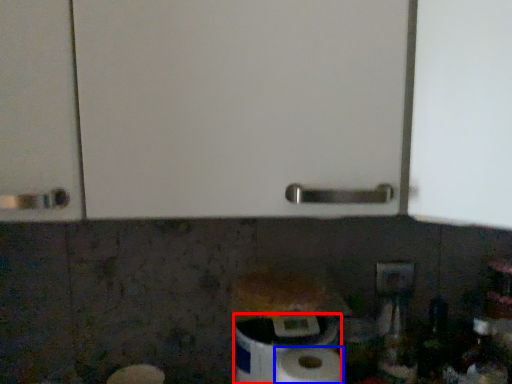
Question: Which object is further to the camera taking this photo, toilet paper (highlighted by a red box) or paper towel (highlighted by a blue box)?

Choices:
 (A) toilet paper
 (B) paper towel

Answer: (A)